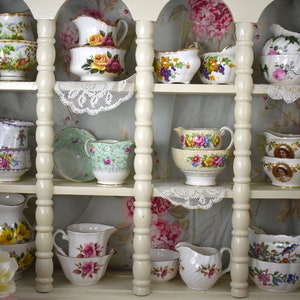
This screenshot has height=300, width=300. In order to click on shelves in this screenshot , I will do click(x=125, y=292), click(x=108, y=191), click(x=164, y=86).